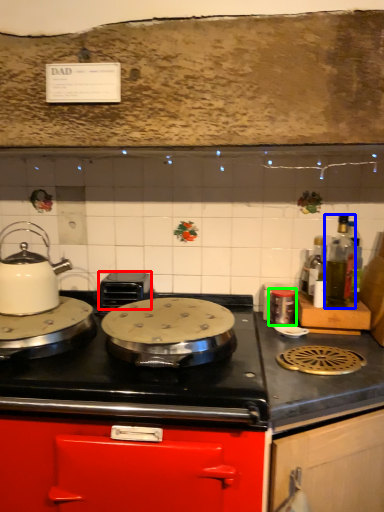
Question: Based on their relative distances, which object is farther from appliance (highlighted by a red box)? Choose from bottle (highlighted by a blue box) and kitchen appliance (highlighted by a green box).

Choices:
 (A) bottle
 (B) kitchen appliance

Answer: (A)